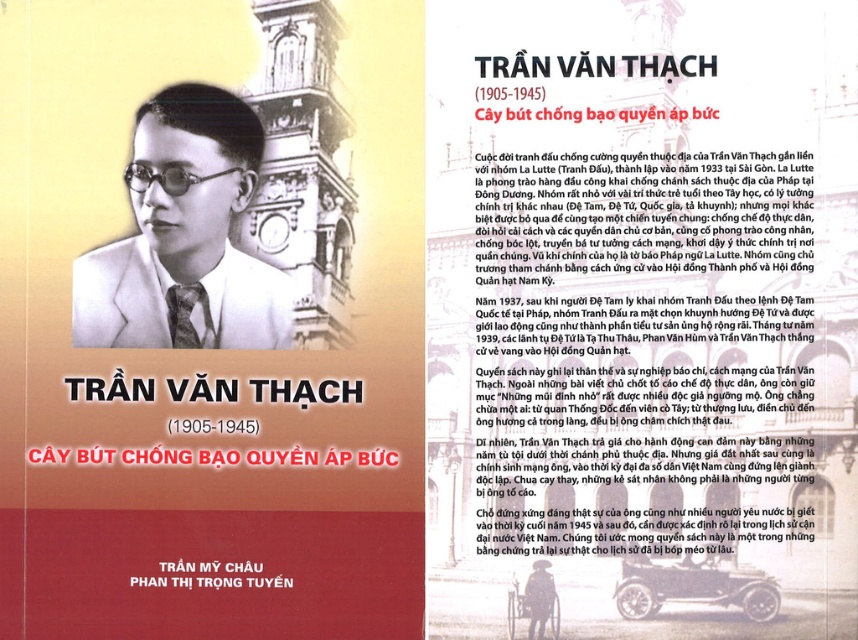
You are designing a digital poster that needs to include both the matte white book cover at center and the white paper at upper center. The minimum required spacing between the two elements is 15 feet. Based on the image, can the current arrangement meet this requirement?

The distance between the matte white book cover at center and the white paper at upper center is 16.12 feet, which exceeds the minimum required spacing of 15 feet. Therefore, the current arrangement meets the requirement.

You are a photographer standing at the camera position. You want to place a matte white book cover at center on a shelf that is 67.72 feet away. Is the shelf far enough for you to clearly see the book cover from your current position?

The matte white book cover at center and camera are 67.72 feet apart, so yes, the shelf is far enough for you to clearly see the book cover from your current position.